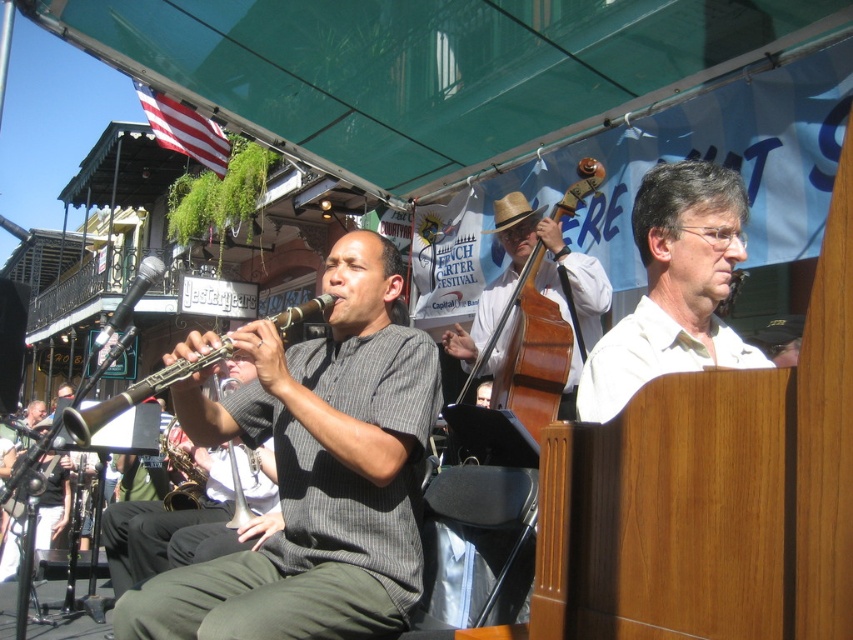
Question: Which of these objects is positioned farthest from the brown wooden cello at center?

Choices:
 (A) white matte shirt at center
 (B) gray striped shirt at center

Answer: (A)

Question: Which point is farther to the camera?

Choices:
 (A) (583, 269)
 (B) (242, 440)
 (C) (730, 252)
 (D) (194, 364)

Answer: (A)

Question: Can you confirm if brown wooden cello at center is smaller than wooden clarinet at center?

Choices:
 (A) yes
 (B) no

Answer: (A)

Question: Can you confirm if gray striped shirt at center is smaller than brown wooden cello at center?

Choices:
 (A) yes
 (B) no

Answer: (A)

Question: Which point is farther to the camera?

Choices:
 (A) gray striped shirt at center
 (B) wooden clarinet at center
 (C) white matte shirt at center

Answer: (B)

Question: Can you confirm if brown wooden cello at center is thinner than wooden clarinet at center?

Choices:
 (A) yes
 (B) no

Answer: (A)